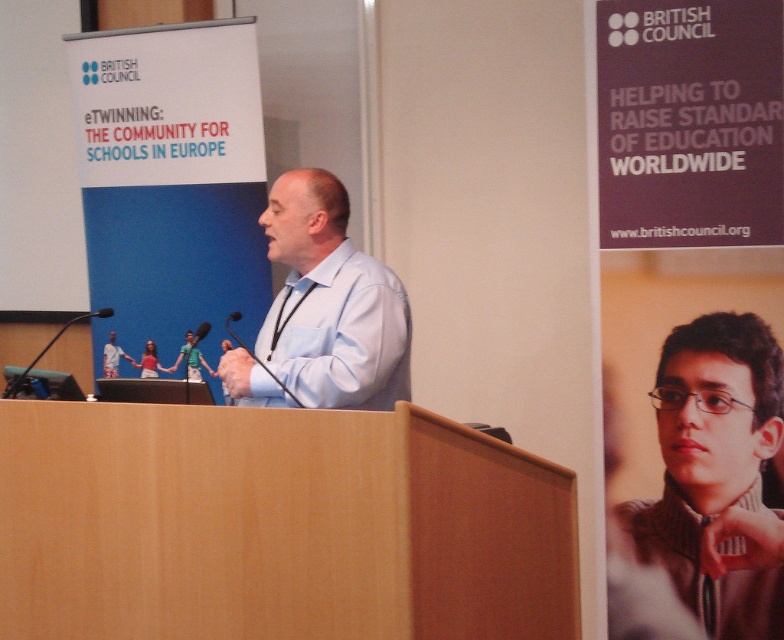
You are attending a conference and notice the light blue shirt at center and the black plastic microphone at lower left. Which object appears narrower from your perspective?

The light blue shirt at center appears narrower than the black plastic microphone at lower left because it has a lesser width according to the description.